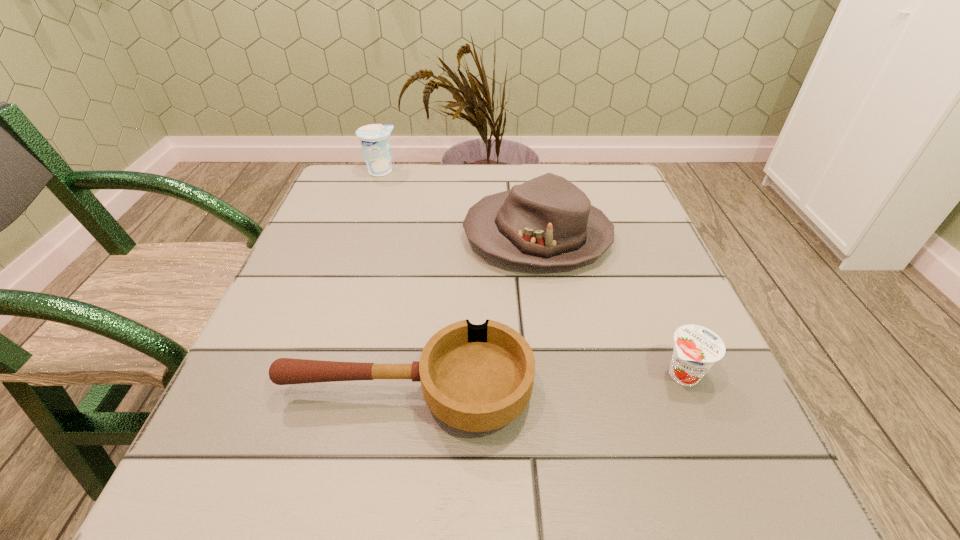
At what (x,y) coordinates should I click in order to perform the action: click on free space that satisfies the following two spatial constraints: 1. on the decorative side of the third nearest object; 2. on the left side of the shorter yogurt. Please return your answer as a coordinate pair (x, y). The image size is (960, 540). Looking at the image, I should click on (560, 374).

Find the location of `free space that satisfies the following two spatial constraints: 1. on the front side of the nearer yogurt; 2. on the right side of the farthest object`. free space that satisfies the following two spatial constraints: 1. on the front side of the nearer yogurt; 2. on the right side of the farthest object is located at coordinates (312, 374).

At what (x,y) coordinates should I click in order to perform the action: click on vacant position in the image that satisfies the following two spatial constraints: 1. on the decorative side of the shorter yogurt; 2. on the left side of the hat. Please return your answer as a coordinate pair (x, y). The image size is (960, 540). Looking at the image, I should click on (560, 374).

Identify the location of free spot that satisfies the following two spatial constraints: 1. with the handle on the side of the right yogurt; 2. on the left side of the saucepan. This screenshot has width=960, height=540. (409, 374).